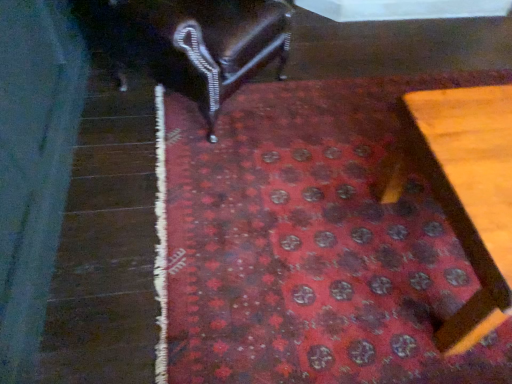
Locate an element on the screen. The height and width of the screenshot is (384, 512). wooden table at lower right, arranged as the first furniture when viewed from the right is located at coordinates (463, 191).

From the image's perspective, who appears lower, wooden table at lower right, arranged as the first furniture when viewed from the right, or shiny dark wood chair at upper left, arranged as the 1th furniture when viewed from the top?

wooden table at lower right, arranged as the first furniture when viewed from the right.

Is shiny dark wood chair at upper left, arranged as the 1th furniture when viewed from the top, a part of wooden table at lower right, the second furniture in the left-to-right sequence?

No, shiny dark wood chair at upper left, arranged as the 1th furniture when viewed from the top, is not surrounded by wooden table at lower right, the second furniture in the left-to-right sequence.

Is wooden table at lower right, the 1th furniture in the bottom-to-top sequence, turned away from shiny dark wood chair at upper left, arranged as the 1th furniture when viewed from the top?

No, shiny dark wood chair at upper left, arranged as the 1th furniture when viewed from the top, is not at the back of wooden table at lower right, the 1th furniture in the bottom-to-top sequence.

Locate an element on the screen. This screenshot has width=512, height=384. furniture that appears below the shiny dark wood chair at upper left, placed as the first furniture when sorted from left to right (from the image's perspective) is located at coordinates (463, 191).

Between shiny dark wood chair at upper left, arranged as the 1th furniture when viewed from the top, and wooden table at lower right, which appears as the second furniture when viewed from the top, which one has larger size?

shiny dark wood chair at upper left, arranged as the 1th furniture when viewed from the top.

Is point (146, 15) less distant than point (453, 182)?

That is False.

Would you say wooden table at lower right, the 1th furniture in the bottom-to-top sequence, is part of shiny dark wood chair at upper left, placed as the first furniture when sorted from left to right,'s contents?

No, wooden table at lower right, the 1th furniture in the bottom-to-top sequence, is not a part of shiny dark wood chair at upper left, placed as the first furniture when sorted from left to right.

Looking at this image, from a real-world perspective, is shiny dark wood chair at upper left, placed as the first furniture when sorted from left to right, positioned over wooden table at lower right, the 1th furniture in the bottom-to-top sequence, based on gravity?

Correct, in the physical world, shiny dark wood chair at upper left, placed as the first furniture when sorted from left to right, is higher than wooden table at lower right, the 1th furniture in the bottom-to-top sequence.

Would you say red carpet at center contains wooden table at lower right, which appears as the second furniture when viewed from the top?

No, wooden table at lower right, which appears as the second furniture when viewed from the top, is not inside red carpet at center.

From a real-world perspective, is red carpet at center positioned under wooden table at lower right, the 1th furniture in the bottom-to-top sequence, based on gravity?

Yes, from a real-world perspective, red carpet at center is under wooden table at lower right, the 1th furniture in the bottom-to-top sequence.

Does point (189, 138) lie behind point (467, 340)?

That is True.

Which of these two, red carpet at center or wooden table at lower right, arranged as the first furniture when viewed from the right, stands shorter?

red carpet at center is shorter.

Does red carpet at center touch shiny dark wood chair at upper left, arranged as the 1th furniture when viewed from the top?

red carpet at center and shiny dark wood chair at upper left, arranged as the 1th furniture when viewed from the top, are clearly separated.

Considering the relative positions of red carpet at center and shiny dark wood chair at upper left, which is the 2th furniture in bottom-to-top order, in the image provided, is red carpet at center to the right of shiny dark wood chair at upper left, which is the 2th furniture in bottom-to-top order, from the viewer's perspective?

Yes, red carpet at center is to the right of shiny dark wood chair at upper left, which is the 2th furniture in bottom-to-top order.

Is point (447, 329) farther from camera compared to point (211, 38)?

No, it is in front of (211, 38).

Which point is more distant from viewer, (409,116) or (336,359)?

Positioned behind is point (409,116).

Is wooden table at lower right, which appears as the second furniture when viewed from the top, placed right next to red carpet at center?

No, wooden table at lower right, which appears as the second furniture when viewed from the top, is not making contact with red carpet at center.

Between wooden table at lower right, the 1th furniture in the bottom-to-top sequence, and red carpet at center, which one has more height?

wooden table at lower right, the 1th furniture in the bottom-to-top sequence, is taller.

From a real-world perspective, is wooden table at lower right, which appears as the second furniture when viewed from the top, located higher than red carpet at center?

Yes, from a real-world perspective, wooden table at lower right, which appears as the second furniture when viewed from the top, is on top of red carpet at center.

From the image's perspective, which one is positioned lower, shiny dark wood chair at upper left, arranged as the 1th furniture when viewed from the top, or red carpet at center?

red carpet at center is shown below in the image.

Which of these two, shiny dark wood chair at upper left, which is the 2th furniture in bottom-to-top order, or red carpet at center, is thinner?

shiny dark wood chair at upper left, which is the 2th furniture in bottom-to-top order.

Is point (268, 5) farther from camera compared to point (506, 345)?

Yes, it is.

Is red carpet at center at the back of shiny dark wood chair at upper left, placed as the first furniture when sorted from left to right?

No.

Find the location of a particular element. The image size is (512, 384). furniture in front of the shiny dark wood chair at upper left, arranged as the 1th furniture when viewed from the top is located at coordinates (463, 191).

The height and width of the screenshot is (384, 512). I want to click on furniture behind the wooden table at lower right, the second furniture in the left-to-right sequence, so click(191, 43).

Based on their spatial positions, is shiny dark wood chair at upper left, positioned as the 2th furniture in right-to-left order, or red carpet at center closer to wooden table at lower right, the second furniture in the left-to-right sequence?

red carpet at center is closer to wooden table at lower right, the second furniture in the left-to-right sequence.

Estimate the real-world distances between objects in this image. Which object is further from red carpet at center, shiny dark wood chair at upper left, positioned as the 2th furniture in right-to-left order, or wooden table at lower right, arranged as the first furniture when viewed from the right?

shiny dark wood chair at upper left, positioned as the 2th furniture in right-to-left order, is further to red carpet at center.

When comparing their distances from shiny dark wood chair at upper left, arranged as the 1th furniture when viewed from the top, does wooden table at lower right, which appears as the second furniture when viewed from the top, or red carpet at center seem closer?

The object closer to shiny dark wood chair at upper left, arranged as the 1th furniture when viewed from the top, is red carpet at center.

Estimate the real-world distances between objects in this image. Which object is further from wooden table at lower right, arranged as the first furniture when viewed from the right, red carpet at center or shiny dark wood chair at upper left, placed as the first furniture when sorted from left to right?

The object further to wooden table at lower right, arranged as the first furniture when viewed from the right, is shiny dark wood chair at upper left, placed as the first furniture when sorted from left to right.

When comparing their distances from red carpet at center, does wooden table at lower right, which appears as the second furniture when viewed from the top, or shiny dark wood chair at upper left, arranged as the 1th furniture when viewed from the top, seem further?

The object further to red carpet at center is shiny dark wood chair at upper left, arranged as the 1th furniture when viewed from the top.

From the image, which object appears to be farther from shiny dark wood chair at upper left, positioned as the 2th furniture in right-to-left order, red carpet at center or wooden table at lower right, the second furniture in the left-to-right sequence?

The object further to shiny dark wood chair at upper left, positioned as the 2th furniture in right-to-left order, is wooden table at lower right, the second furniture in the left-to-right sequence.

The image size is (512, 384). Identify the location of mat between shiny dark wood chair at upper left, placed as the first furniture when sorted from left to right, and wooden table at lower right, arranged as the first furniture when viewed from the right, in the horizontal direction. tap(316, 241).